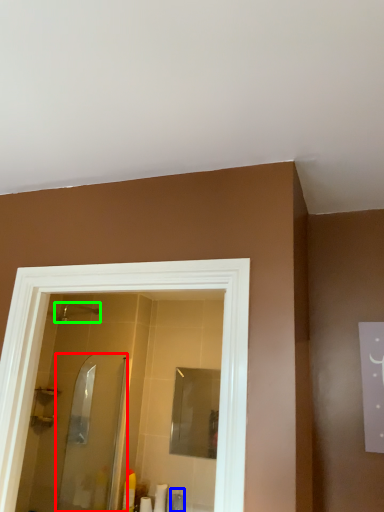
Question: Which object is the farthest from screen door (highlighted by a red box)? Choose among these: toiletry (highlighted by a blue box) or shower (highlighted by a green box).

Choices:
 (A) toiletry
 (B) shower

Answer: (B)